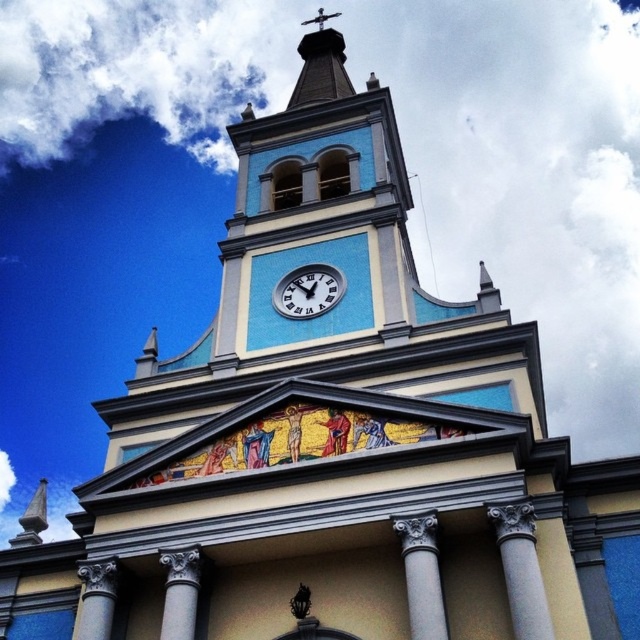
Does white marble column at lower center appear over white glossy clock at center?

Incorrect, white marble column at lower center is not positioned above white glossy clock at center.

Is white marble column at lower center positioned at the back of white glossy clock at center?

No.

Which is behind, point (442, 596) or point (282, 292)?

The point (282, 292) is behind.

The height and width of the screenshot is (640, 640). I want to click on white marble column at lower center, so click(x=420, y=576).

Is white marble column at center smaller than gray stone column at lower center?

Incorrect, white marble column at center is not smaller in size than gray stone column at lower center.

Which is in front, point (518, 572) or point (189, 627)?

Point (518, 572) is more forward.

Image resolution: width=640 pixels, height=640 pixels. What are the coordinates of `white marble column at center` in the screenshot? It's located at (522, 570).

Is point (513, 540) positioned in front of point (109, 632)?

Yes.

Between white marble column at center and gray stone column at lower left, which one has less height?

Standing shorter between the two is gray stone column at lower left.

Describe the element at coordinates (522, 570) in the screenshot. I see `white marble column at center` at that location.

This screenshot has height=640, width=640. Identify the location of white marble column at center. (522, 570).